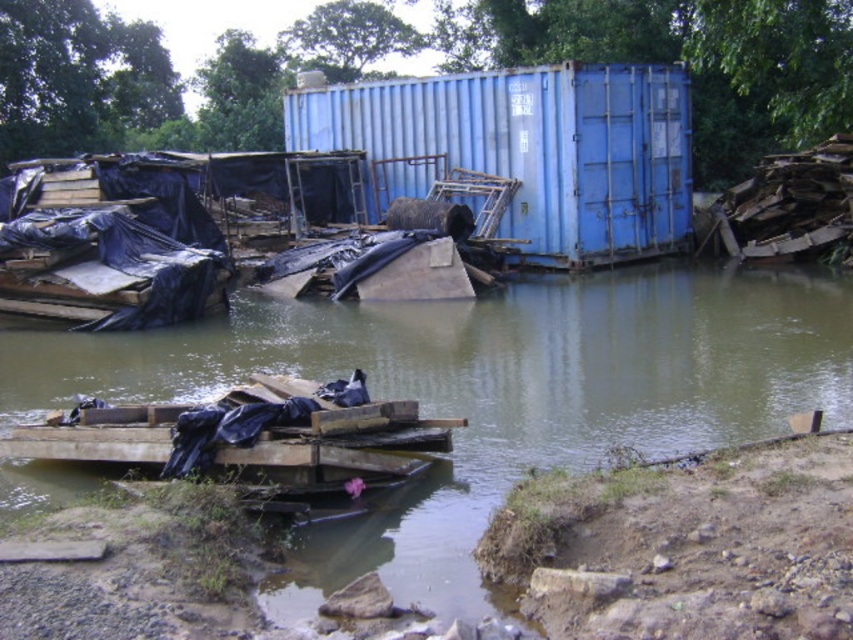
Question: Which object appears closest to the camera in this image?

Choices:
 (A) blue matte shipping container at center
 (B) brown muddy water at center

Answer: (B)

Question: Which point appears farthest from the camera in this image?

Choices:
 (A) (383, 380)
 (B) (291, 144)

Answer: (B)

Question: Is brown muddy water at center to the left of blue matte shipping container at center from the viewer's perspective?

Choices:
 (A) yes
 (B) no

Answer: (A)

Question: Is brown muddy water at center wider than blue matte shipping container at center?

Choices:
 (A) no
 (B) yes

Answer: (B)

Question: Is brown muddy water at center above blue matte shipping container at center?

Choices:
 (A) yes
 (B) no

Answer: (B)